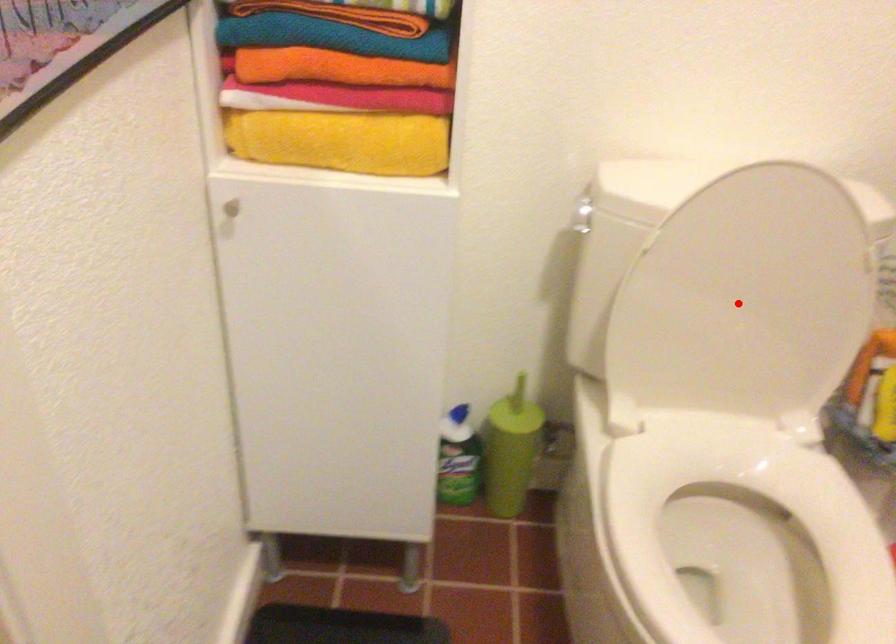
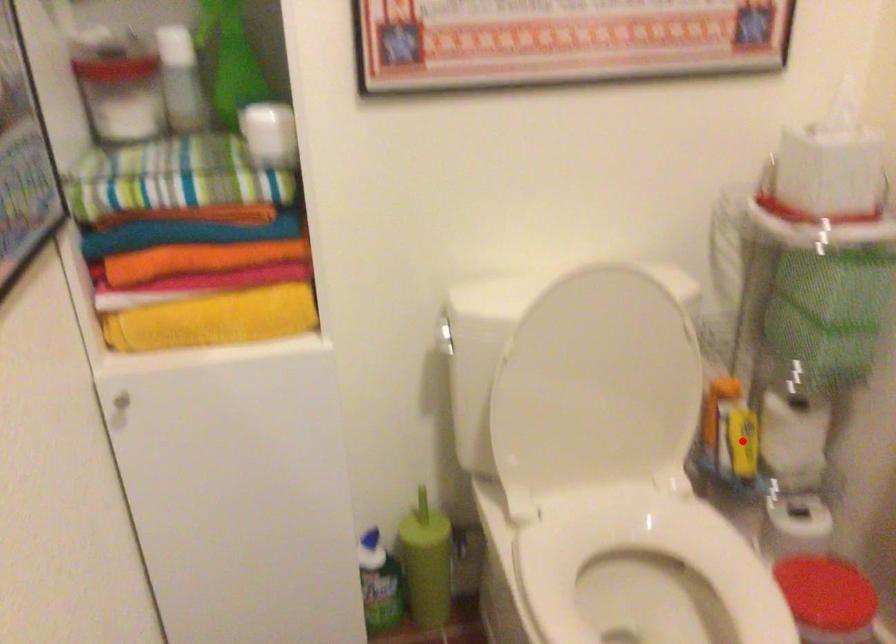
I am providing you with two images of the same scene from different viewpoints. A red point is marked on the first image and another point is marked on the second image. Is the marked point in image1 the same physical position as the marked point in image2?

No